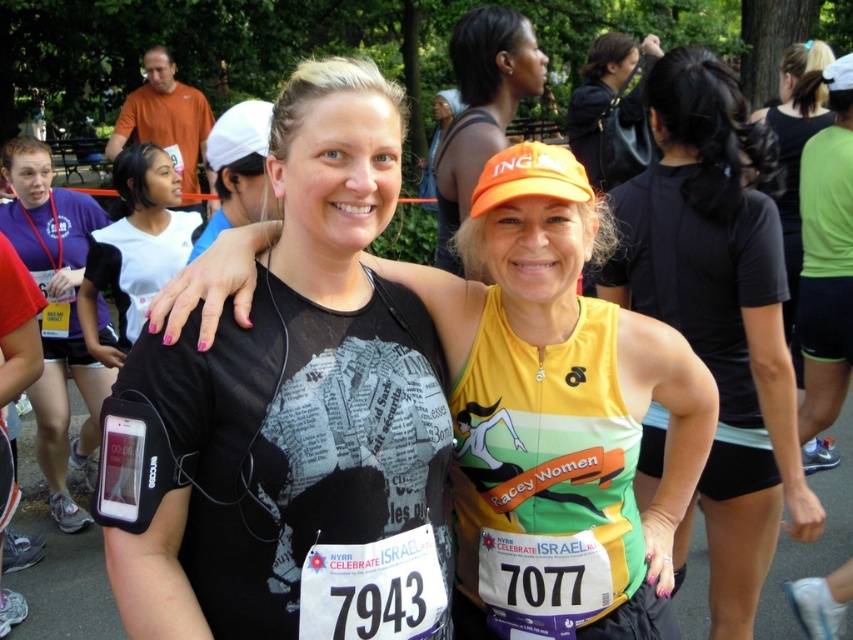
Question: Does yellow-green jersey at center appear on the left side of white matte shirt at center?

Choices:
 (A) yes
 (B) no

Answer: (B)

Question: Does matte purple shirt at left appear on the right side of white matte shirt at center?

Choices:
 (A) no
 (B) yes

Answer: (A)

Question: Which object appears closest to the camera in this image?

Choices:
 (A) orange matte cap at upper center
 (B) white matte shirt at center
 (C) matte purple shirt at left

Answer: (A)

Question: Does matte purple shirt at left appear over orange matte cap at upper center?

Choices:
 (A) yes
 (B) no

Answer: (B)

Question: Which point is closer to the camera?

Choices:
 (A) (21, 198)
 (B) (354, 355)

Answer: (B)

Question: Considering the real-world distances, which object is closest to the orange matte cap at upper center?

Choices:
 (A) matte purple shirt at left
 (B) white matte shirt at center
 (C) black mesh tank top at center

Answer: (B)